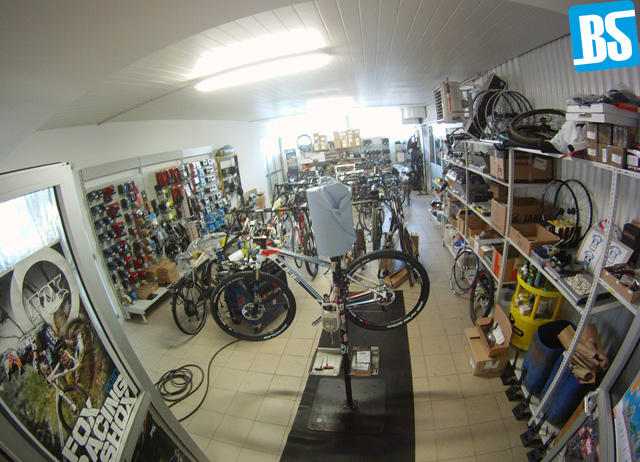
Find the location of a particular element. This screenshot has height=462, width=640. metal shelf is located at coordinates (572, 297).